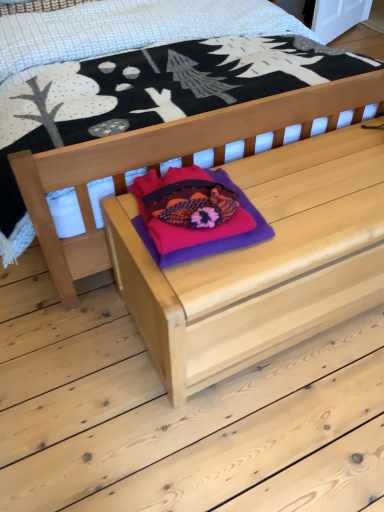
Question: Is purple felt throw pillow at center far away from natural wood bed at center?

Choices:
 (A) no
 (B) yes

Answer: (A)

Question: From a real-world perspective, is purple felt throw pillow at center on natural wood bed at center?

Choices:
 (A) yes
 (B) no

Answer: (B)

Question: Can you confirm if purple felt throw pillow at center is shorter than natural wood bed at center?

Choices:
 (A) yes
 (B) no

Answer: (A)

Question: Is natural wood bed at center located within purple felt throw pillow at center?

Choices:
 (A) no
 (B) yes

Answer: (A)

Question: Is purple felt throw pillow at center looking in the opposite direction of natural wood bed at center?

Choices:
 (A) yes
 (B) no

Answer: (A)

Question: Considering the positions of purple felt throw pillow at center and natural wood bed at center in the image, is purple felt throw pillow at center taller or shorter than natural wood bed at center?

Choices:
 (A) short
 (B) tall

Answer: (A)

Question: From a real-world perspective, is purple felt throw pillow at center above or below natural wood bed at center?

Choices:
 (A) below
 (B) above

Answer: (A)

Question: Considering the relative positions of purple felt throw pillow at center and natural wood bed at center in the image provided, is purple felt throw pillow at center to the left or to the right of natural wood bed at center?

Choices:
 (A) left
 (B) right

Answer: (B)

Question: Considering their positions, is purple felt throw pillow at center located in front of or behind natural wood bed at center?

Choices:
 (A) front
 (B) behind

Answer: (B)

Question: From the image's perspective, is natural wood bed at center located above or below natural wood chest at center?

Choices:
 (A) below
 (B) above

Answer: (B)

Question: In terms of height, does natural wood bed at center look taller or shorter compared to natural wood chest at center?

Choices:
 (A) short
 (B) tall

Answer: (B)

Question: From a real-world perspective, is natural wood bed at center positioned above or below natural wood chest at center?

Choices:
 (A) below
 (B) above

Answer: (B)

Question: Is natural wood bed at center bigger or smaller than natural wood chest at center?

Choices:
 (A) small
 (B) big

Answer: (B)

Question: From a real-world perspective, is natural wood chest at center above or below purple felt throw pillow at center?

Choices:
 (A) above
 (B) below

Answer: (B)

Question: Based on their sizes in the image, would you say natural wood chest at center is bigger or smaller than purple felt throw pillow at center?

Choices:
 (A) big
 (B) small

Answer: (A)